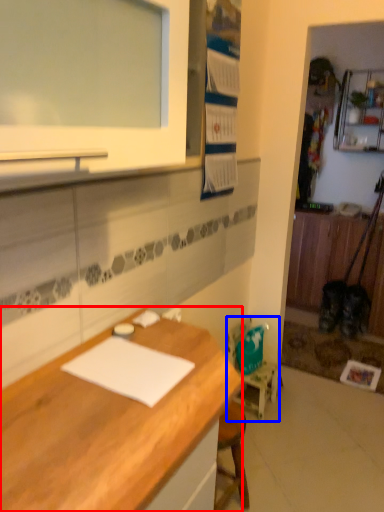
Question: Which of the following is the closest to the observer, desk (highlighted by a red box) or chair (highlighted by a blue box)?

Choices:
 (A) desk
 (B) chair

Answer: (A)